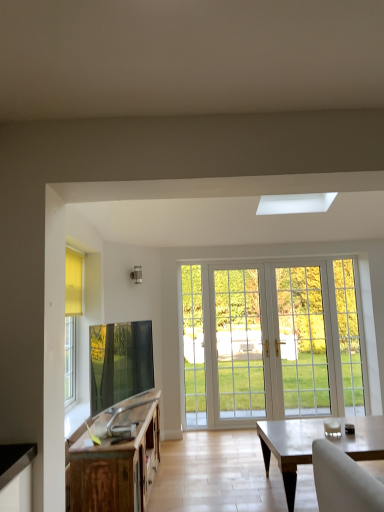
Image resolution: width=384 pixels, height=512 pixels. Identify the location of matte wooden coffee table at lower right. click(x=289, y=448).

The height and width of the screenshot is (512, 384). Describe the element at coordinates (289, 448) in the screenshot. I see `matte wooden coffee table at lower right` at that location.

This screenshot has height=512, width=384. What are the coordinates of `wooden cabinet at lower left` in the screenshot? It's located at (117, 459).

The height and width of the screenshot is (512, 384). What do you see at coordinates (117, 459) in the screenshot?
I see `wooden cabinet at lower left` at bounding box center [117, 459].

The width and height of the screenshot is (384, 512). I want to click on matte wooden coffee table at lower right, so click(289, 448).

Between matte wooden coffee table at lower right and wooden cabinet at lower left, which one appears on the left side from the viewer's perspective?

wooden cabinet at lower left.

Is matte wooden coffee table at lower right positioned before wooden cabinet at lower left?

That is False.

Does point (262, 432) lie in front of point (128, 502)?

No.

From the image's perspective, does matte wooden coffee table at lower right appear higher than wooden cabinet at lower left?

Actually, matte wooden coffee table at lower right appears below wooden cabinet at lower left in the image.

From a real-world perspective, between matte wooden coffee table at lower right and wooden cabinet at lower left, who is vertically higher?

wooden cabinet at lower left, from a real-world perspective.

Based on the photo, which object is thinner, matte wooden coffee table at lower right or wooden cabinet at lower left?

wooden cabinet at lower left is thinner.

Considering the sizes of matte wooden coffee table at lower right and wooden cabinet at lower left in the image, is matte wooden coffee table at lower right taller or shorter than wooden cabinet at lower left?

In the image, matte wooden coffee table at lower right appears to be shorter than wooden cabinet at lower left.

Considering the sizes of matte wooden coffee table at lower right and wooden cabinet at lower left in the image, is matte wooden coffee table at lower right bigger or smaller than wooden cabinet at lower left?

Clearly, matte wooden coffee table at lower right is smaller in size than wooden cabinet at lower left.

Is matte wooden coffee table at lower right not within wooden cabinet at lower left?

Yes, matte wooden coffee table at lower right is located beyond the bounds of wooden cabinet at lower left.

Is matte wooden coffee table at lower right placed right next to wooden cabinet at lower left?

No, matte wooden coffee table at lower right is not next to wooden cabinet at lower left.

Is matte wooden coffee table at lower right facing away from wooden cabinet at lower left?

matte wooden coffee table at lower right does not have its back to wooden cabinet at lower left.

Identify the location of cabinetry in front of the matte wooden coffee table at lower right. The width and height of the screenshot is (384, 512). (117, 459).

Which is more to the right, wooden cabinet at lower left or matte wooden coffee table at lower right?

matte wooden coffee table at lower right is more to the right.

Which object is further away from the camera taking this photo, wooden cabinet at lower left or matte wooden coffee table at lower right?

matte wooden coffee table at lower right is more distant.

Is point (130, 409) less distant than point (366, 452)?

That is True.

From the image's perspective, would you say wooden cabinet at lower left is positioned over matte wooden coffee table at lower right?

Yes.

From a real-world perspective, does wooden cabinet at lower left stand above matte wooden coffee table at lower right?

Yes, from a real-world perspective, wooden cabinet at lower left is above matte wooden coffee table at lower right.

Is wooden cabinet at lower left wider or thinner than matte wooden coffee table at lower right?

Clearly, wooden cabinet at lower left has less width compared to matte wooden coffee table at lower right.

Considering the sizes of objects wooden cabinet at lower left and matte wooden coffee table at lower right in the image provided, who is shorter, wooden cabinet at lower left or matte wooden coffee table at lower right?

Standing shorter between the two is matte wooden coffee table at lower right.

In terms of size, does wooden cabinet at lower left appear bigger or smaller than matte wooden coffee table at lower right?

Clearly, wooden cabinet at lower left is larger in size than matte wooden coffee table at lower right.

Is wooden cabinet at lower left not within matte wooden coffee table at lower right?

Yes, wooden cabinet at lower left is outside of matte wooden coffee table at lower right.

Is wooden cabinet at lower left not close to matte wooden coffee table at lower right?

Yes, wooden cabinet at lower left and matte wooden coffee table at lower right are quite far apart.

Is wooden cabinet at lower left positioned with its back to matte wooden coffee table at lower right?

No.

At what (x,y) coordinates should I click in order to perform the action: click on coffee table that appears below the wooden cabinet at lower left (from the image's perspective). Please return your answer as a coordinate pair (x, y). Looking at the image, I should click on (289, 448).

Locate an element on the screen. coffee table behind the wooden cabinet at lower left is located at coordinates (289, 448).

Locate an element on the screen. This screenshot has width=384, height=512. coffee table that is on the right side of wooden cabinet at lower left is located at coordinates (289, 448).